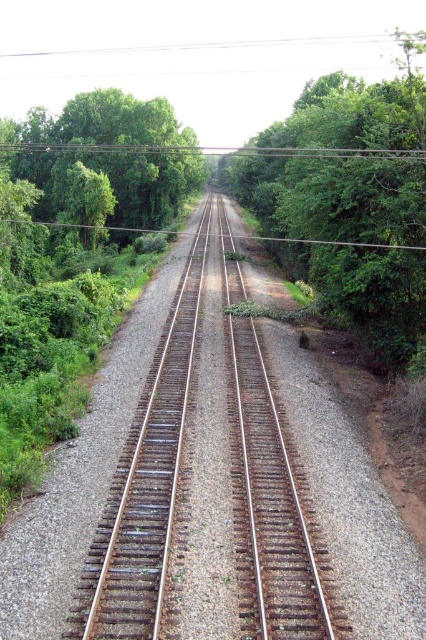
You are standing at the point with coordinates point (209, 484) in the image. What surface are you standing on?

The point (209, 484) is on rusty metal tracks at center, so you are standing on the rusty metal tracks.